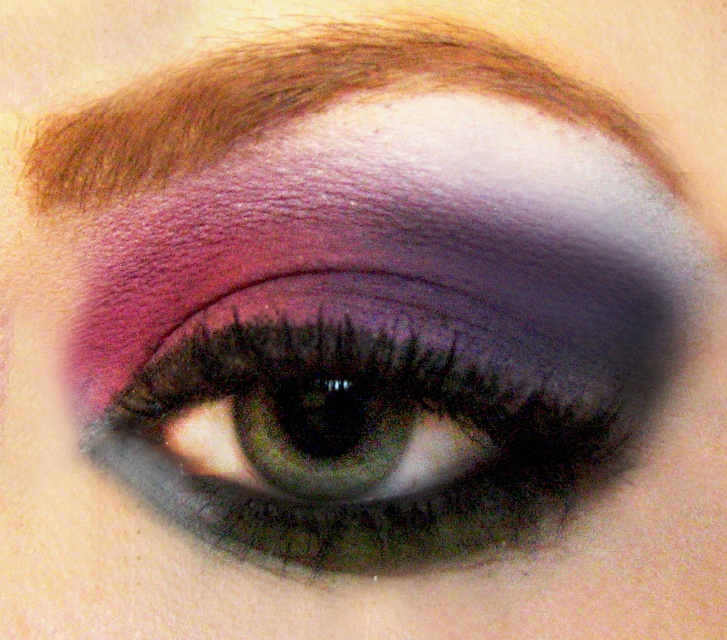
You are a makeup artist analyzing an eye makeup design. You notice the shimmering pink eyeshadow at center and the brown hair at upper center. Which of these two elements is positioned higher on the face?

The shimmering pink eyeshadow at center is taller than brown hair at upper center, so the shimmering pink eyeshadow at center is positioned higher on the face.

You are a makeup artist analyzing the eye makeup in the image. You notice a specific point at coordinates point (385, 412). What type of eyeshadow is applied at that exact point?

The point (385, 412) has shimmering pink eyeshadow applied at that exact location.

You are a makeup artist trying to replicate this look. You have a client whose eyelid is slightly smaller than the one in the image. If you want to place the shimmering pink eyeshadow at center exactly where it is in the image, where should you apply it relative to the eyelid?

The shimmering pink eyeshadow at center should be applied at the coordinates point [385,412] relative to the eyelid to replicate the exact position shown in the image.